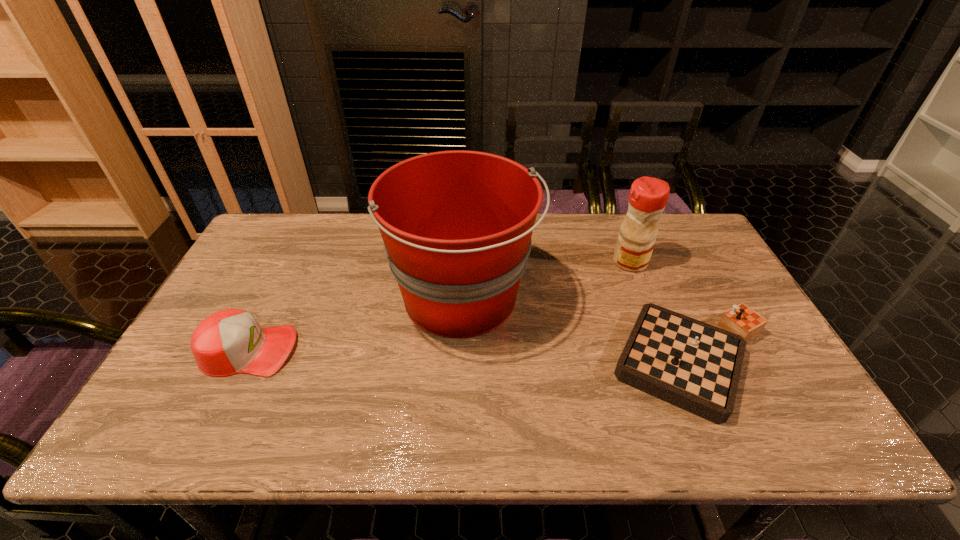
The height and width of the screenshot is (540, 960). I want to click on bucket, so click(457, 225).

Where is `the tallest object`? The height and width of the screenshot is (540, 960). the tallest object is located at coordinates (457, 225).

In order to click on the third shortest object in this screenshot , I will do `click(648, 196)`.

Identify the location of baseball cap. (231, 341).

Where is `the leftmost object`? The image size is (960, 540). the leftmost object is located at coordinates (231, 341).

The width and height of the screenshot is (960, 540). I want to click on chessboard, so click(693, 365).

You are a GUI agent. You are given a task and a screenshot of the screen. Output one action in this format:
    pyautogui.click(x=<x>, y=<y>)
    Task: Click on the vacant space situated 0.190m on the right of the bucket
    The height and width of the screenshot is (540, 960).
    Given the screenshot: What is the action you would take?
    pyautogui.click(x=602, y=298)

Identify the location of vacant position located on the left of the third shortest object. (581, 262).

Image resolution: width=960 pixels, height=540 pixels. In order to click on vacant space situated on the front-facing side of the leftmost object in this screenshot , I will do `click(334, 350)`.

Identify the location of vacant space located on the back of the shortest object. (651, 264).